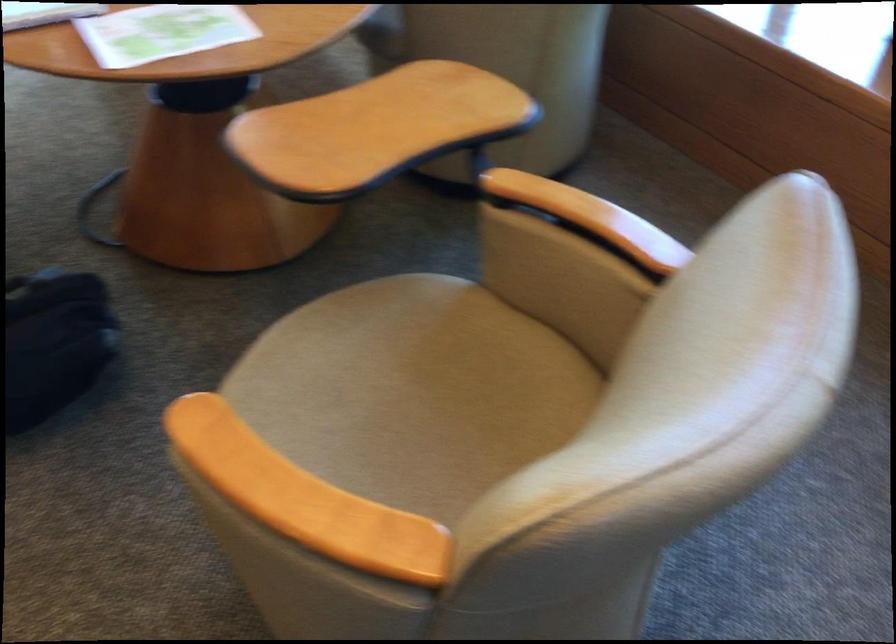
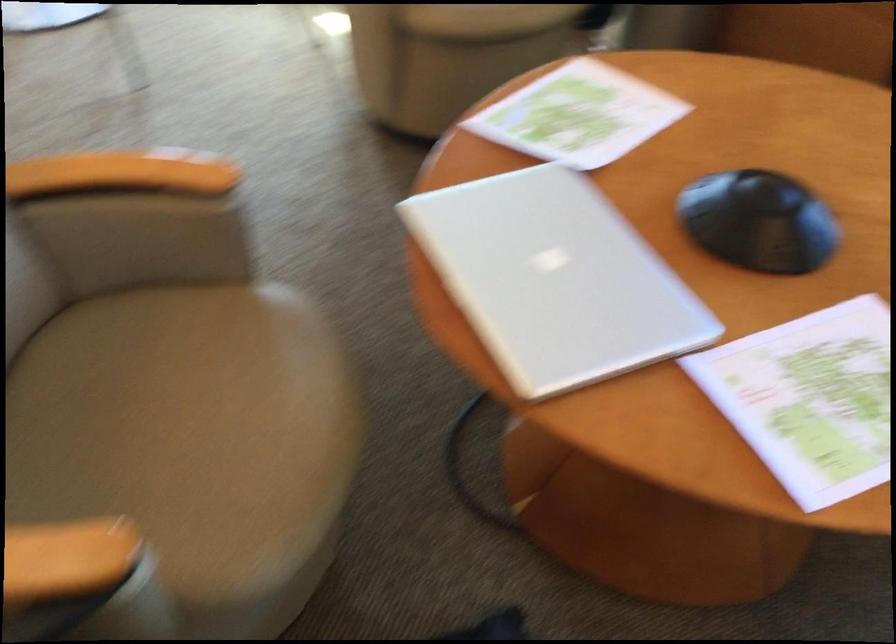
Based on the photo, what movement of the cameraman would produce the second image?

The cameraman moved toward left, forward.